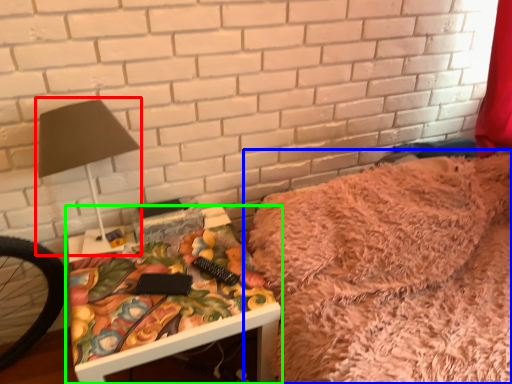
Question: Which object is positioned farthest from table lamp (highlighted by a red box)? Select from furniture (highlighted by a blue box) and table (highlighted by a green box).

Choices:
 (A) furniture
 (B) table

Answer: (A)